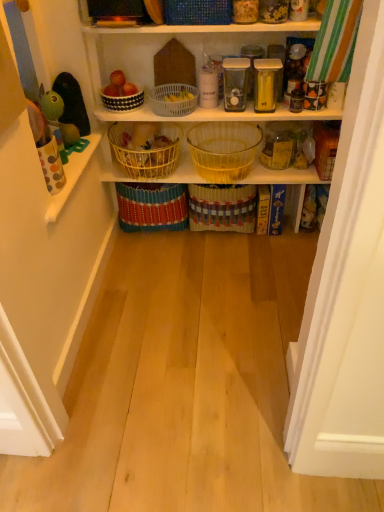
Question: Does white plastic basket at upper center, marked as the fifth basket in a bottom-to-top arrangement, have a greater width compared to white dotted bowl at upper center, placed as the second basket when sorted from top to bottom?

Choices:
 (A) no
 (B) yes

Answer: (B)

Question: Is white plastic basket at upper center, which is counted as the third basket, starting from the top, positioned with its back to white dotted bowl at upper center, the sixth basket when ordered from bottom to top?

Choices:
 (A) yes
 (B) no

Answer: (B)

Question: Considering the relative sizes of white plastic basket at upper center, which is counted as the third basket, starting from the top, and white dotted bowl at upper center, placed as the second basket when sorted from top to bottom, in the image provided, is white plastic basket at upper center, which is counted as the third basket, starting from the top, smaller than white dotted bowl at upper center, placed as the second basket when sorted from top to bottom,?

Choices:
 (A) no
 (B) yes

Answer: (A)

Question: Is white plastic basket at upper center, marked as the fifth basket in a bottom-to-top arrangement, at the left side of white dotted bowl at upper center, placed as the second basket when sorted from top to bottom?

Choices:
 (A) yes
 (B) no

Answer: (B)

Question: From the image's perspective, is white plastic basket at upper center, which is counted as the third basket, starting from the top, below white dotted bowl at upper center, placed as the second basket when sorted from top to bottom?

Choices:
 (A) yes
 (B) no

Answer: (A)

Question: From a real-world perspective, is white dotted bowl at upper center, placed as the second basket when sorted from top to bottom, physically located above or below blue woven basket at upper center, marked as the 1th basket in a top-to-bottom arrangement?

Choices:
 (A) above
 (B) below

Answer: (B)

Question: From the image's perspective, is white dotted bowl at upper center, placed as the second basket when sorted from top to bottom, positioned above or below blue woven basket at upper center, arranged as the seventh basket when ordered from the bottom?

Choices:
 (A) above
 (B) below

Answer: (B)

Question: In terms of height, does white dotted bowl at upper center, the sixth basket when ordered from bottom to top, look taller or shorter compared to blue woven basket at upper center, marked as the 1th basket in a top-to-bottom arrangement?

Choices:
 (A) short
 (B) tall

Answer: (A)

Question: Relative to blue woven basket at upper center, arranged as the seventh basket when ordered from the bottom, is white dotted bowl at upper center, the sixth basket when ordered from bottom to top, in front or behind?

Choices:
 (A) front
 (B) behind

Answer: (B)

Question: Based on their sizes in the image, would you say yellow wire basket at center, the 4th basket positioned from the bottom, is bigger or smaller than white plastic basket at upper center, which is counted as the third basket, starting from the top?

Choices:
 (A) big
 (B) small

Answer: (A)

Question: Does point (148, 172) appear closer or farther from the camera than point (163, 104)?

Choices:
 (A) closer
 (B) farther

Answer: (B)

Question: Relative to white plastic basket at upper center, marked as the fifth basket in a bottom-to-top arrangement, is yellow wire basket at center, the 4th basket positioned from the bottom, in front or behind?

Choices:
 (A) behind
 (B) front

Answer: (A)

Question: From a real-world perspective, is yellow wire basket at center, positioned as the 4th basket in top-to-bottom order, above or below white plastic basket at upper center, which is counted as the third basket, starting from the top?

Choices:
 (A) below
 (B) above

Answer: (A)

Question: Is point (165, 188) closer or farther from the camera than point (145, 175)?

Choices:
 (A) closer
 (B) farther

Answer: (B)

Question: Is bright yellow woven basket at center, which appears as the 2th basket when ordered from the bottom, bigger or smaller than yellow wire basket at center, positioned as the 4th basket in top-to-bottom order?

Choices:
 (A) small
 (B) big

Answer: (B)